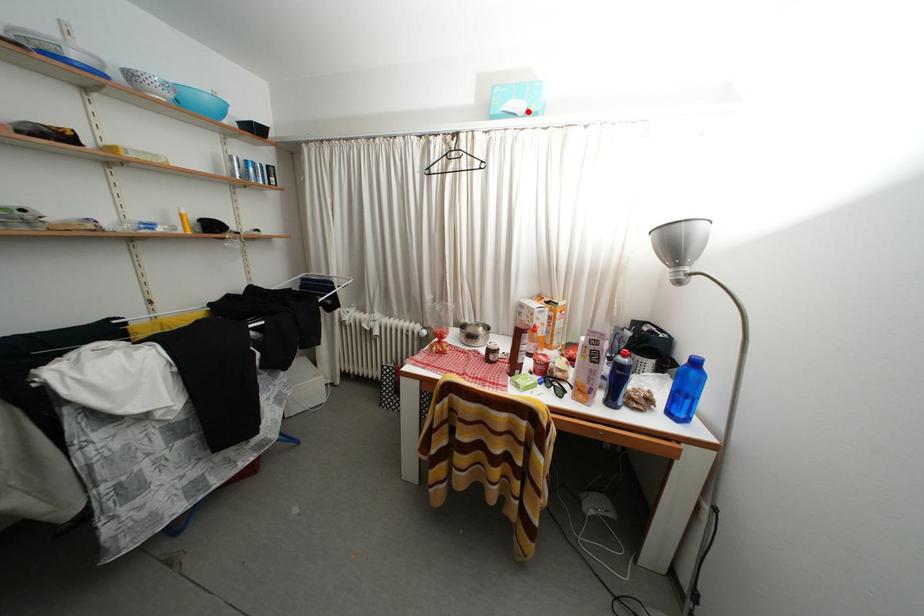
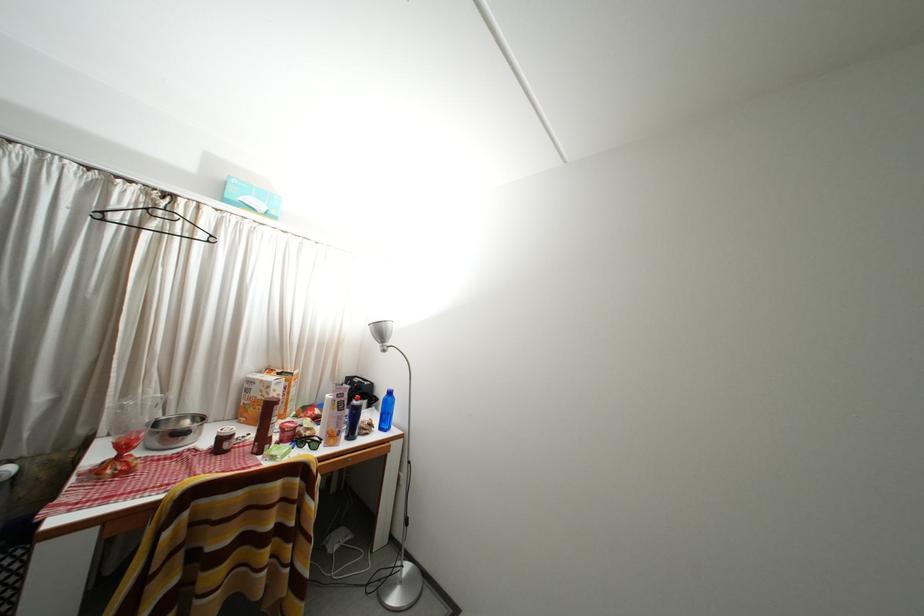
Question: I am providing you with two images of the same scene from different viewpoints. A red point is marked on the first image. At the location where the point appears in image 1, is it still visible in image 2?

Choices:
 (A) Yes
 (B) No

Answer: (A)